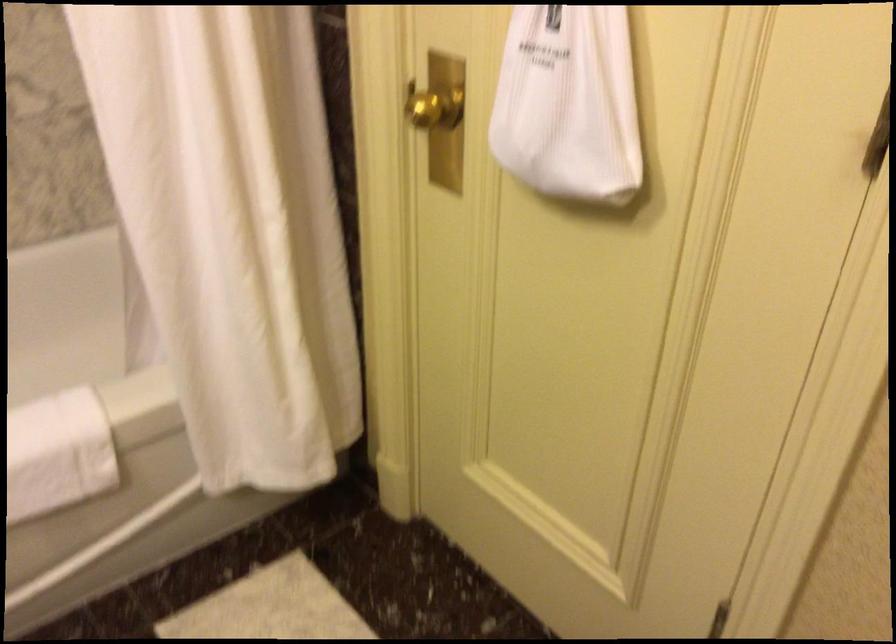
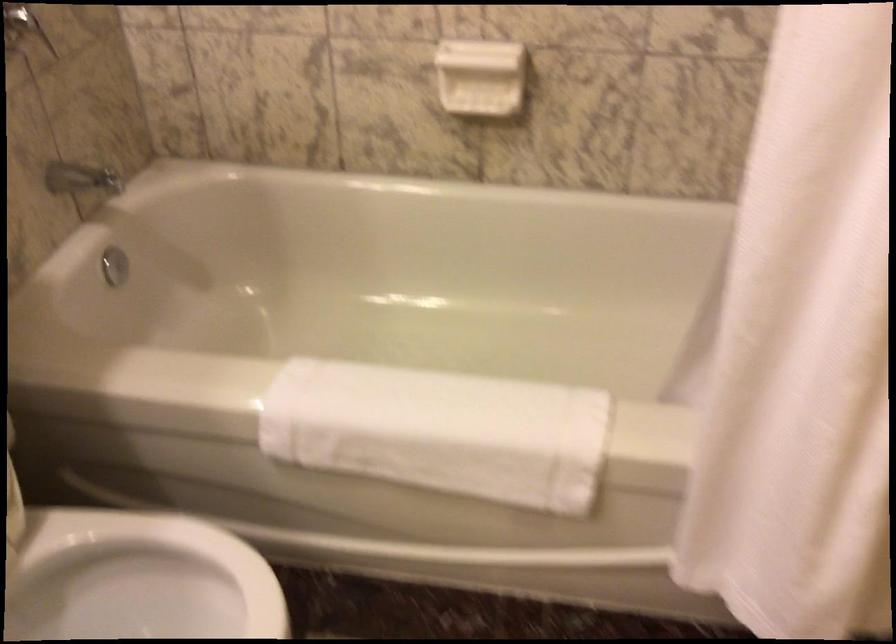
Question: The images are taken continuously from a first-person perspective. In which direction is your viewpoint rotating?

Choices:
 (A) Left
 (B) Right
 (C) Up
 (D) Down

Answer: (A)